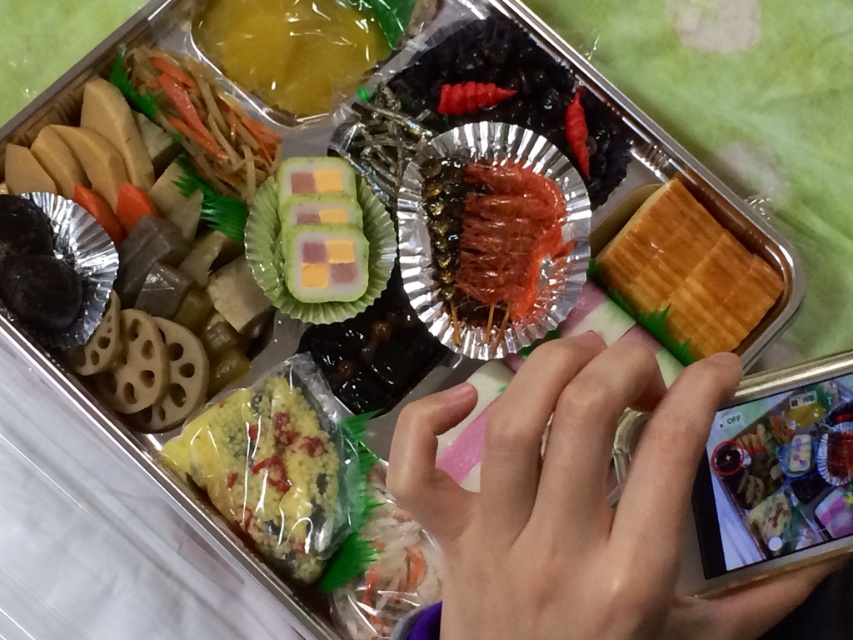
Question: From the image, what is the correct spatial relationship of shiny red skewered shrimp at center in relation to golden waffle at right?

Choices:
 (A) left
 (B) right

Answer: (A)

Question: Which point is farther to the camera?

Choices:
 (A) (471, 564)
 (B) (689, 353)
 (C) (294, 88)
 (D) (495, 179)

Answer: (C)

Question: Considering the real-world distances, which object is closest to the pale skin at center?

Choices:
 (A) yellow rice at center
 (B) yellow translucent gelatin at upper left

Answer: (A)

Question: Can you confirm if shiny red skewered shrimp at center is positioned above yellow translucent gelatin at upper left?

Choices:
 (A) yes
 (B) no

Answer: (B)

Question: Is shiny red skewered shrimp at center above yellow rice at center?

Choices:
 (A) yes
 (B) no

Answer: (A)

Question: Which point is farther from the camera taking this photo?

Choices:
 (A) (320, 522)
 (B) (233, 61)
 (C) (592, 348)
 (D) (474, 352)

Answer: (B)